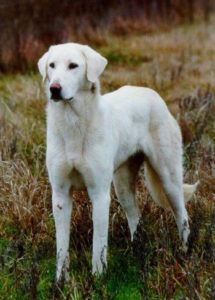
In order to click on white fur in this screenshot , I will do `click(119, 118)`.